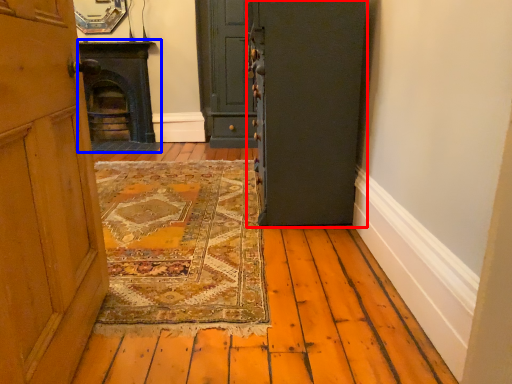
Question: Which point is further to the camera, door (highlighted by a red box) or fireplace (highlighted by a blue box)?

Choices:
 (A) door
 (B) fireplace

Answer: (B)